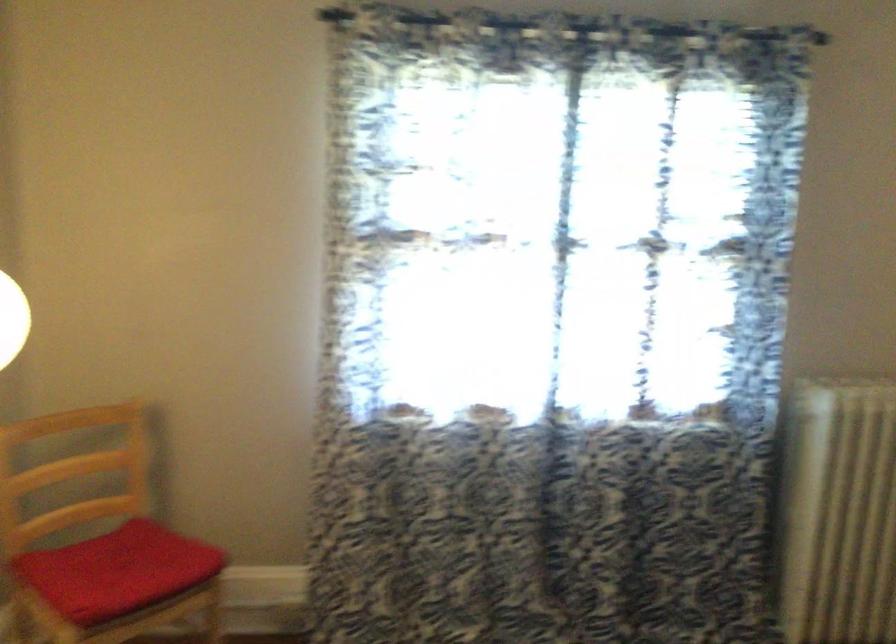
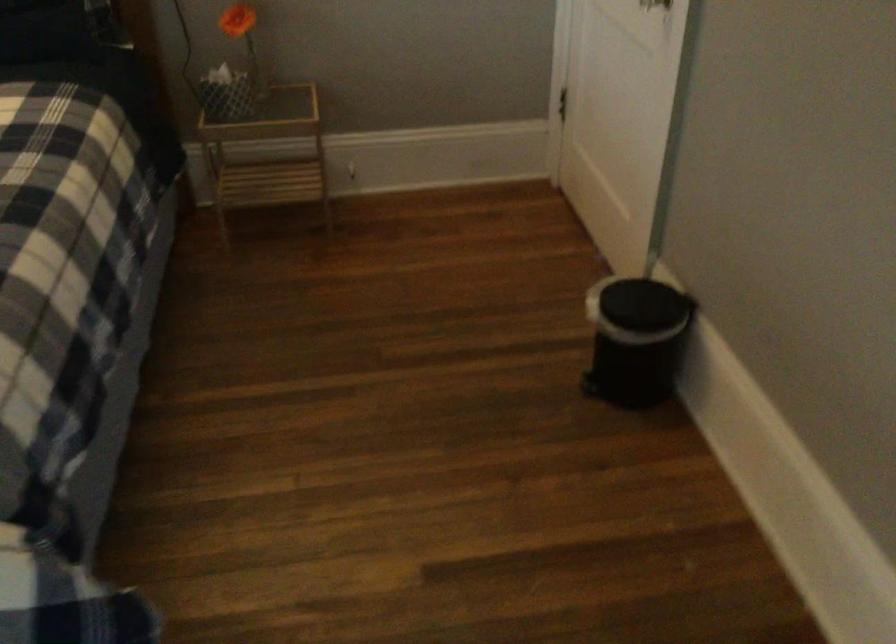
The first image is from the beginning of the video and the second image is from the end. How did the camera likely rotate when shooting the video?

The camera rotated toward right-down.